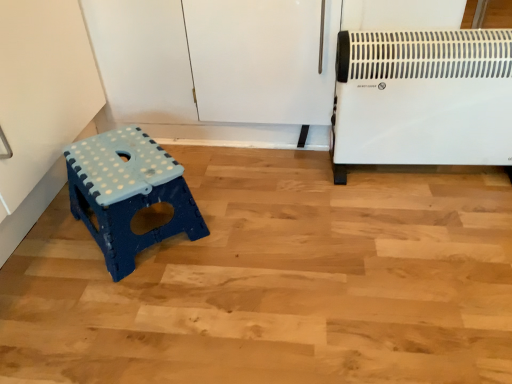
This screenshot has width=512, height=384. In order to click on vacant space underneath white plastic heater at right (from a real-world perspective) in this screenshot , I will do `click(416, 178)`.